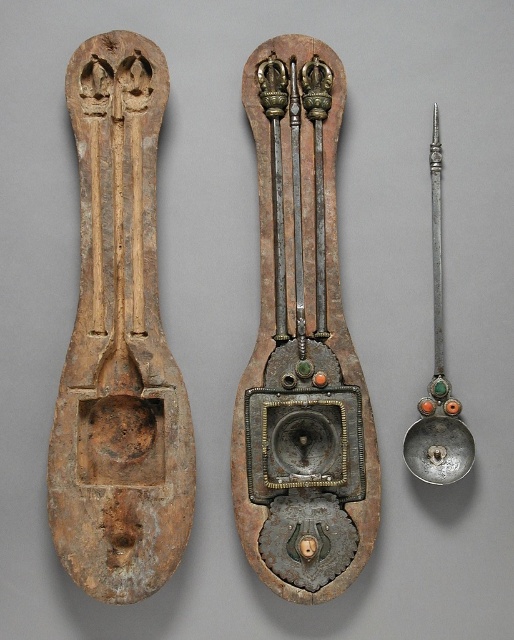
Question: Can you confirm if brown wood spoon at center is thinner than silver/golden metal spoon at right?

Choices:
 (A) yes
 (B) no

Answer: (B)

Question: Can you confirm if brown wood spoon at center is positioned to the right of silver/golden metal spoon at right?

Choices:
 (A) no
 (B) yes

Answer: (A)

Question: Estimate the real-world distances between objects in this image. Which object is closer to the brown wood spoon at center?

Choices:
 (A) silver/golden metal spoon at right
 (B) polished metal spoon at center

Answer: (B)

Question: Estimate the real-world distances between objects in this image. Which object is farther from the brown wood spoon at center?

Choices:
 (A) polished metal spoon at center
 (B) silver/golden metal spoon at right

Answer: (B)

Question: Does polished metal spoon at center have a larger size compared to silver/golden metal spoon at right?

Choices:
 (A) no
 (B) yes

Answer: (B)

Question: Which of the following is the farthest from the observer?

Choices:
 (A) brown wood spoon at center
 (B) silver/golden metal spoon at right
 (C) polished metal spoon at center

Answer: (B)